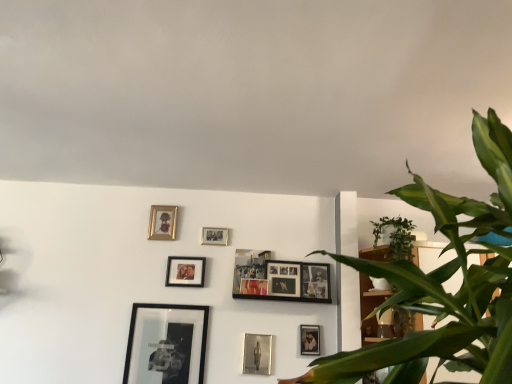
Question: From a real-world perspective, is matte black picture frame at lower center, the ninth picture frame from the left, under wooden bookshelf at right?

Choices:
 (A) yes
 (B) no

Answer: (A)

Question: Is matte black picture frame at lower center, marked as the 2th picture frame in a right-to-left arrangement, behind wooden bookshelf at right?

Choices:
 (A) no
 (B) yes

Answer: (B)

Question: Can you confirm if matte black picture frame at lower center, the ninth picture frame from the left, is wider than wooden bookshelf at right?

Choices:
 (A) yes
 (B) no

Answer: (B)

Question: Is there a large distance between matte black picture frame at lower center, the ninth picture frame from the left, and wooden bookshelf at right?

Choices:
 (A) no
 (B) yes

Answer: (A)

Question: Is matte black picture frame at lower center, marked as the 2th picture frame in a right-to-left arrangement, shorter than wooden bookshelf at right?

Choices:
 (A) yes
 (B) no

Answer: (A)

Question: Can you confirm if matte black picture frame at lower center, marked as the 2th picture frame in a right-to-left arrangement, is thinner than wooden bookshelf at right?

Choices:
 (A) yes
 (B) no

Answer: (A)

Question: Does metallic silver photo frame at upper center, marked as the fourth picture frame in a left-to-right arrangement, have a larger size compared to matte black picture frame at center, which is the 5th picture frame from left to right?

Choices:
 (A) no
 (B) yes

Answer: (A)

Question: Is metallic silver photo frame at upper center, the 7th picture frame from the right, turned away from matte black picture frame at center, which is the 6th picture frame from right to left?

Choices:
 (A) yes
 (B) no

Answer: (B)

Question: Does metallic silver photo frame at upper center, the 7th picture frame from the right, have a greater height compared to matte black picture frame at center, which is the 5th picture frame from left to right?

Choices:
 (A) no
 (B) yes

Answer: (A)

Question: Is metallic silver photo frame at upper center, the 7th picture frame from the right, not close to matte black picture frame at center, which is the 6th picture frame from right to left?

Choices:
 (A) yes
 (B) no

Answer: (B)

Question: From the image's perspective, would you say metallic silver photo frame at upper center, the 7th picture frame from the right, is shown under matte black picture frame at center, which is the 5th picture frame from left to right?

Choices:
 (A) yes
 (B) no

Answer: (B)

Question: Does metallic silver photo frame at upper center, marked as the fourth picture frame in a left-to-right arrangement, have a smaller size compared to matte black picture frame at center, which is the 6th picture frame from right to left?

Choices:
 (A) yes
 (B) no

Answer: (A)

Question: From a real-world perspective, is matte black picture frame at center, arranged as the 6th picture frame when viewed from the left, beneath wooden frame at upper left, which appears as the 10th picture frame when viewed from the right?

Choices:
 (A) no
 (B) yes

Answer: (B)